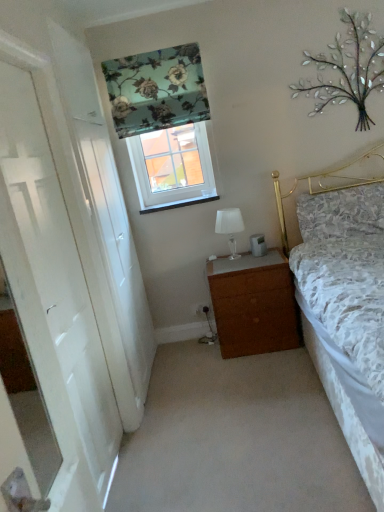
Question: Is floral fabric pillow at upper right not inside white glossy door at left?

Choices:
 (A) yes
 (B) no

Answer: (A)

Question: Is floral fabric pillow at upper right thinner than white glossy door at left?

Choices:
 (A) no
 (B) yes

Answer: (A)

Question: Can you confirm if floral fabric pillow at upper right is wider than white glossy door at left?

Choices:
 (A) no
 (B) yes

Answer: (B)

Question: Does floral fabric pillow at upper right appear on the left side of white glossy door at left?

Choices:
 (A) yes
 (B) no

Answer: (B)

Question: Is floral fabric pillow at upper right shorter than white glossy door at left?

Choices:
 (A) yes
 (B) no

Answer: (A)

Question: In terms of width, does floral fabric pillow at upper right look wider or thinner when compared to white glossy door at left?

Choices:
 (A) thin
 (B) wide

Answer: (B)

Question: In the image, is floral fabric pillow at upper right positioned in front of or behind white glossy door at left?

Choices:
 (A) behind
 (B) front

Answer: (A)

Question: From a real-world perspective, is floral fabric pillow at upper right positioned above or below white glossy door at left?

Choices:
 (A) above
 (B) below

Answer: (B)

Question: Would you say floral fabric pillow at upper right is to the left or to the right of white glossy door at left in the picture?

Choices:
 (A) left
 (B) right

Answer: (B)

Question: From a real-world perspective, is white glossy door at left above or below white glass table lamp at center?

Choices:
 (A) below
 (B) above

Answer: (B)

Question: From the image's perspective, is white glossy door at left above or below white glass table lamp at center?

Choices:
 (A) below
 (B) above

Answer: (A)

Question: Is white glossy door at left inside or outside of white glass table lamp at center?

Choices:
 (A) inside
 (B) outside

Answer: (B)

Question: Is point (23, 300) closer or farther from the camera than point (233, 250)?

Choices:
 (A) closer
 (B) farther

Answer: (A)

Question: In the image, is white glass table lamp at center positioned in front of or behind white glossy door at left?

Choices:
 (A) behind
 (B) front

Answer: (A)

Question: From the image's perspective, is white glass table lamp at center positioned above or below white glossy door at left?

Choices:
 (A) below
 (B) above

Answer: (B)